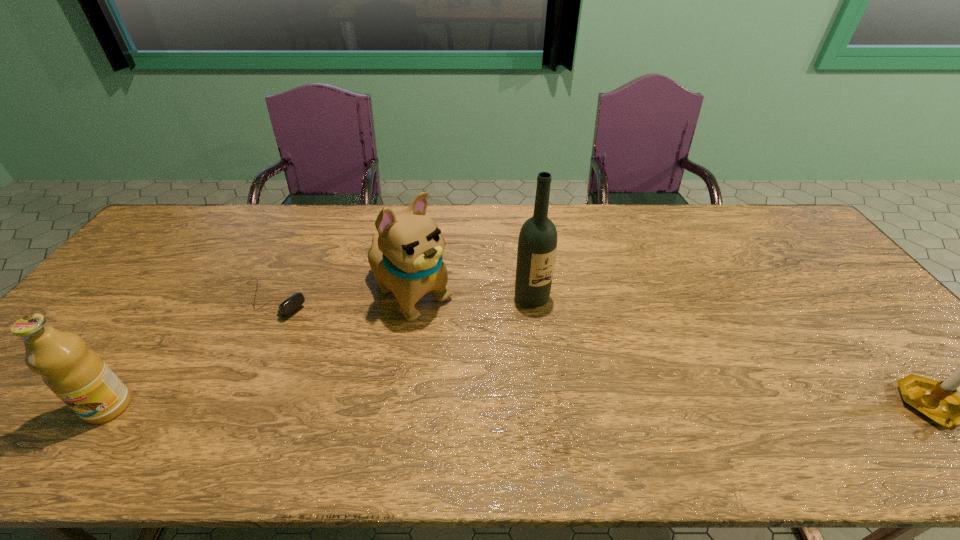
Where is `vacant area at the right edge`? vacant area at the right edge is located at coordinates (867, 306).

Find the location of a particular element. Image resolution: width=960 pixels, height=540 pixels. free space between the fourth object from left to right and the puppy is located at coordinates (471, 296).

You are a GUI agent. You are given a task and a screenshot of the screen. Output one action in this format:
    pyautogui.click(x=<x>, y=<y>)
    Task: Click on the free space between the third object from right to left and the leftmost object
    The height and width of the screenshot is (540, 960).
    Given the screenshot: What is the action you would take?
    pyautogui.click(x=260, y=350)

Where is `vacant space that is in between the wine bottle and the second tallest object`? The height and width of the screenshot is (540, 960). vacant space that is in between the wine bottle and the second tallest object is located at coordinates (471, 296).

In order to click on free space between the fourth shortest object and the shortest object in this screenshot , I will do `click(342, 297)`.

Find the location of a particular element. The width and height of the screenshot is (960, 540). empty location between the third object from left to right and the third tallest object is located at coordinates (260, 350).

Identify the location of vacant space that's between the third tallest object and the fourth shortest object. The width and height of the screenshot is (960, 540). 260,350.

Choose which object is the second nearest neighbor to the second shortest object. Please provide its 2D coordinates. Your answer should be formatted as a tuple, i.e. [(x, y)], where the tuple contains the x and y coordinates of a point satisfying the conditions above.

[(406, 257)]

This screenshot has height=540, width=960. Identify the location of object that is the nearest to the third object from right to left. (294, 301).

The image size is (960, 540). I want to click on vacant space that satisfies the following two spatial constraints: 1. on the front side of the fourth object from left to right; 2. on the left side of the third object from left to right, so click(410, 298).